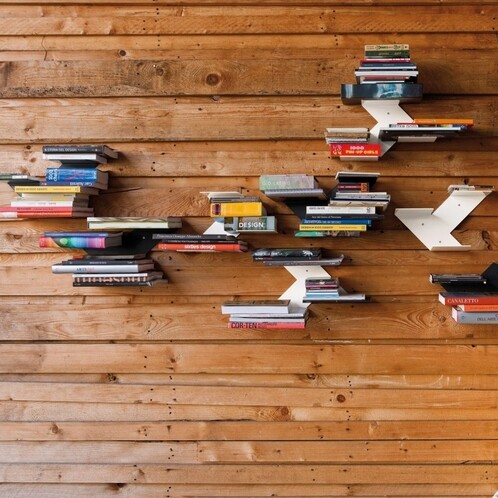
Where is `book shelving on the wall`? book shelving on the wall is located at coordinates (382, 107), (454, 206), (305, 271), (492, 280), (137, 245), (132, 223), (68, 163), (297, 203).